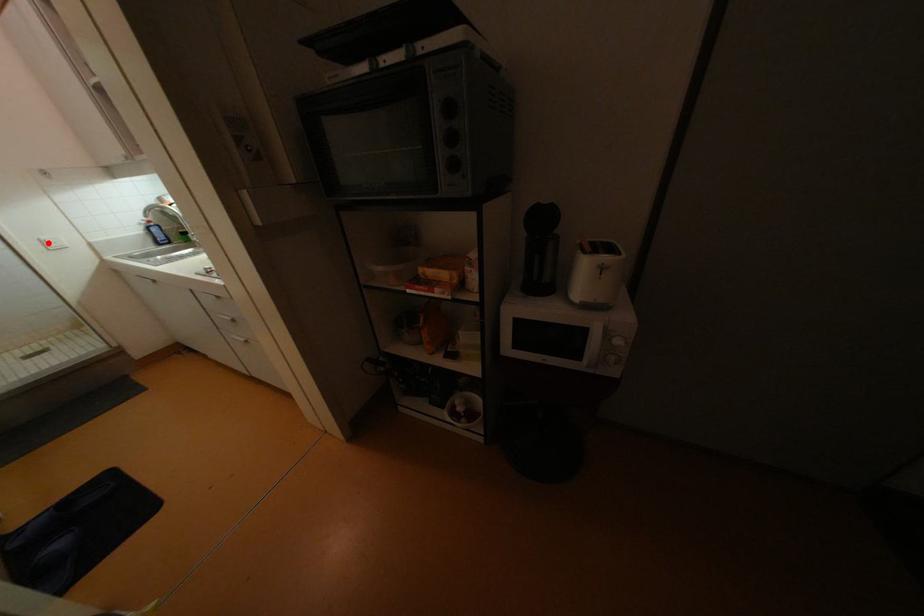
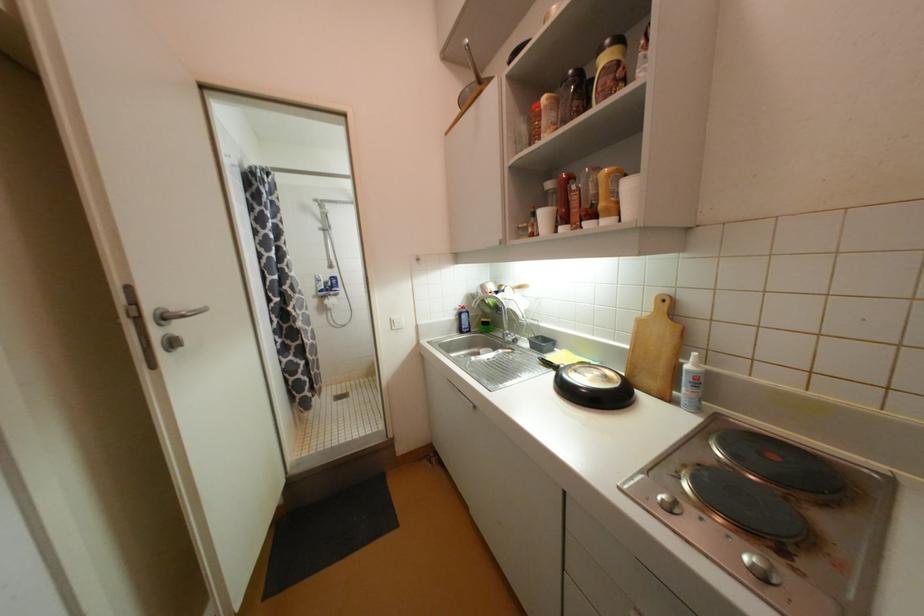
Find the pixel in the second image that matches the highlighted location in the first image.

(396, 323)